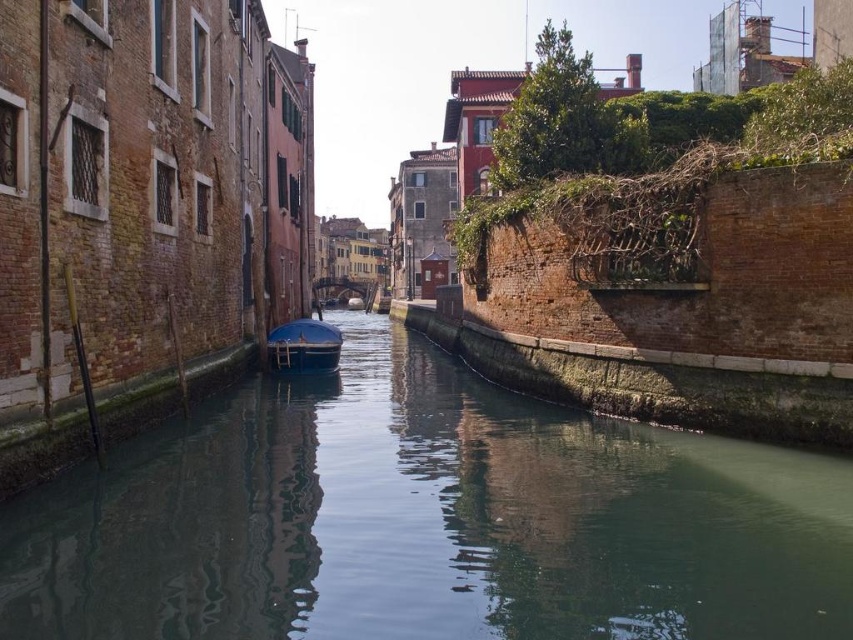
You are a tourist standing on the bridge overlooking the canal. You want to take a photo that captures both the green smooth water at center and the matte blue boat at center. Since you have a wide angle lens, will you be able to fit both objects into the frame without moving your position?

The green smooth water at center has a larger size compared to matte blue boat at center. Since the water is larger, it will occupy more of the frame, but as long as the boat is within the water area, both should fit in the frame with a wide angle lens without needing to move.

You are a tourist standing at the edge of the canal and want to take a photo of the green smooth water at center. According to the scene description, where exactly is the green smooth water located?

The green smooth water at center is located at point (427, 520).